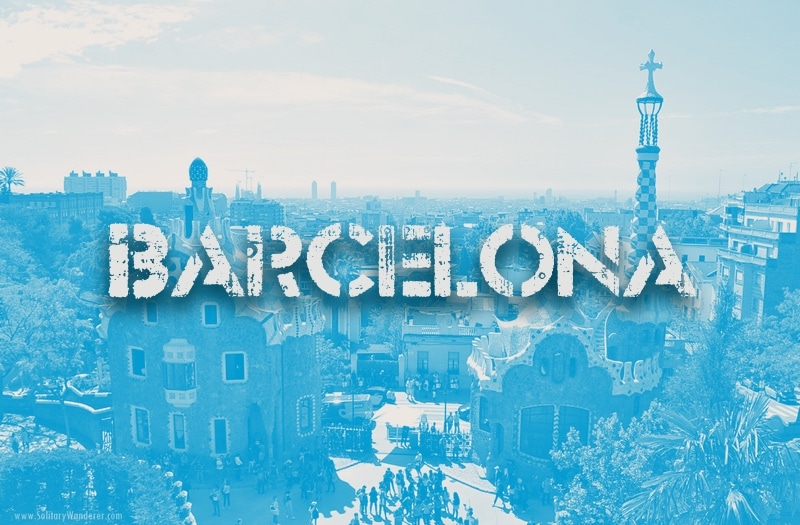
Find the location of a particular element. top floor windows is located at coordinates (210, 316), (160, 320), (156, 313).